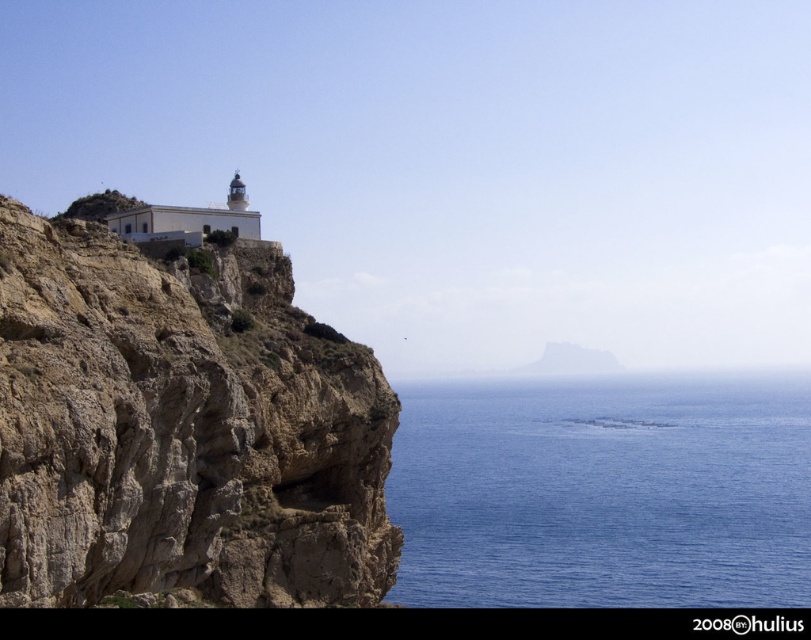
Question: Is brown rough rock at upper left to the right of blue water at lower right from the viewer's perspective?

Choices:
 (A) no
 (B) yes

Answer: (A)

Question: Is brown rough rock at upper left above blue water at lower right?

Choices:
 (A) no
 (B) yes

Answer: (B)

Question: Where is brown rough rock at upper left located in relation to blue water at lower right in the image?

Choices:
 (A) above
 (B) below

Answer: (A)